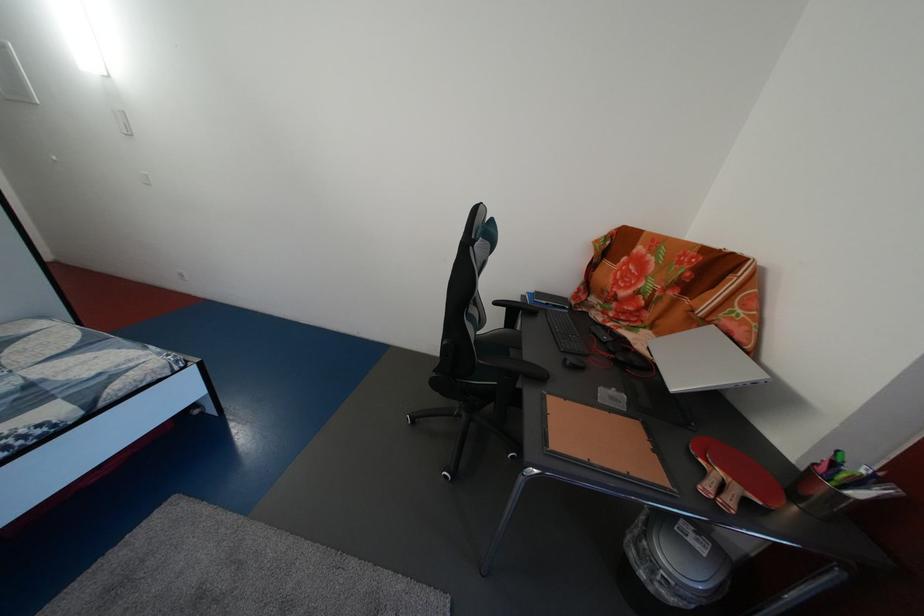
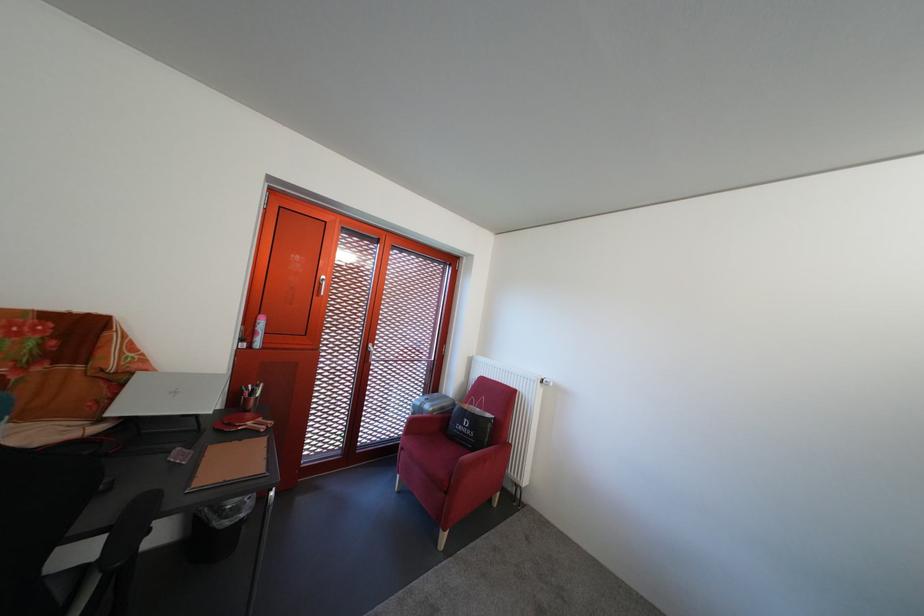
Find the pixel in the second image that matches point (642, 560) in the first image.

(237, 530)